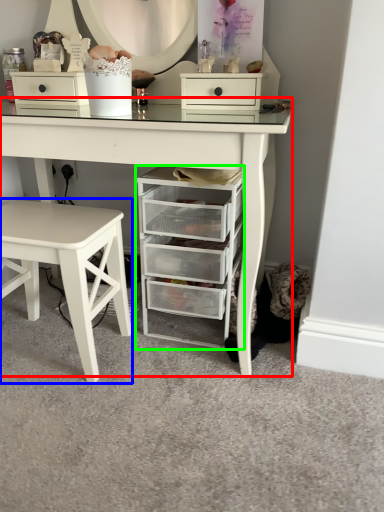
Question: Which object is positioned closest to table (highlighted by a red box)? Select from stool (highlighted by a blue box) and chest of drawers (highlighted by a green box).

Choices:
 (A) stool
 (B) chest of drawers

Answer: (B)